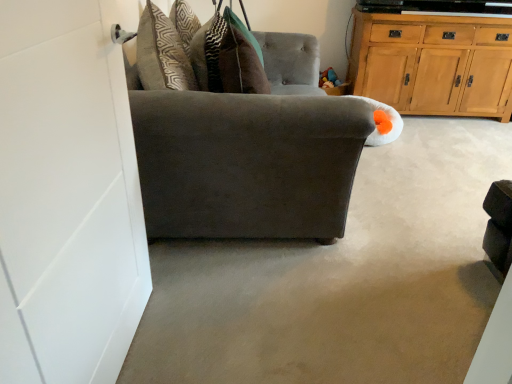
Question: Should I look upward or downward to see dark gray fabric couch at center?

Choices:
 (A) up
 (B) down

Answer: (A)

Question: From a real-world perspective, is suede gray chair at left on top of wooden cabinet at upper right?

Choices:
 (A) yes
 (B) no

Answer: (B)

Question: Is the position of suede gray chair at left more distant than that of wooden cabinet at upper right?

Choices:
 (A) yes
 (B) no

Answer: (B)

Question: Is suede gray chair at left not inside wooden cabinet at upper right?

Choices:
 (A) no
 (B) yes

Answer: (B)

Question: Would you say suede gray chair at left is a long distance from wooden cabinet at upper right?

Choices:
 (A) no
 (B) yes

Answer: (B)

Question: Does suede gray chair at left have a smaller size compared to wooden cabinet at upper right?

Choices:
 (A) no
 (B) yes

Answer: (A)

Question: Can you confirm if suede gray chair at left is wider than wooden cabinet at upper right?

Choices:
 (A) no
 (B) yes

Answer: (B)

Question: Considering the relative sizes of suede gray chair at left and dark gray fabric couch at center in the image provided, is suede gray chair at left thinner than dark gray fabric couch at center?

Choices:
 (A) yes
 (B) no

Answer: (A)

Question: Does suede gray chair at left lie behind dark gray fabric couch at center?

Choices:
 (A) no
 (B) yes

Answer: (B)

Question: From a real-world perspective, does suede gray chair at left stand above dark gray fabric couch at center?

Choices:
 (A) no
 (B) yes

Answer: (B)

Question: Considering the relative sizes of suede gray chair at left and dark gray fabric couch at center in the image provided, is suede gray chair at left wider than dark gray fabric couch at center?

Choices:
 (A) yes
 (B) no

Answer: (B)

Question: Considering the relative positions of suede gray chair at left and dark gray fabric couch at center in the image provided, is suede gray chair at left to the right of dark gray fabric couch at center from the viewer's perspective?

Choices:
 (A) yes
 (B) no

Answer: (B)

Question: From the image's perspective, is suede gray chair at left on dark gray fabric couch at center?

Choices:
 (A) yes
 (B) no

Answer: (A)

Question: Is wooden cabinet at upper right thinner than dark gray fabric couch at center?

Choices:
 (A) no
 (B) yes

Answer: (B)